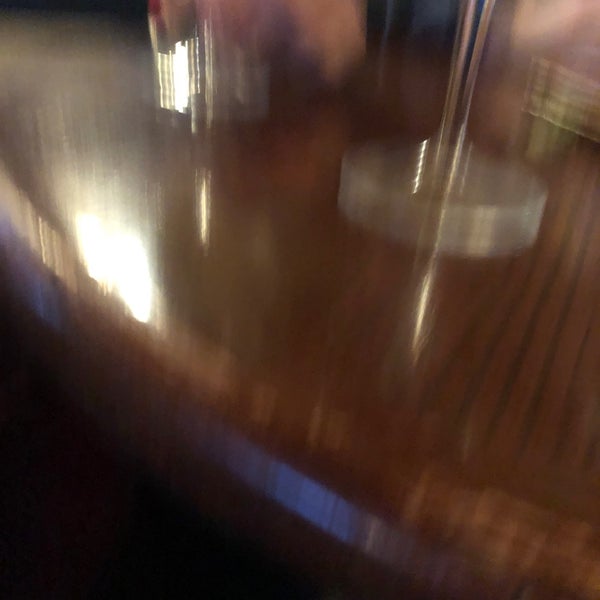
This screenshot has height=600, width=600. What are the coordinates of `table edge` in the screenshot? It's located at 175,420.